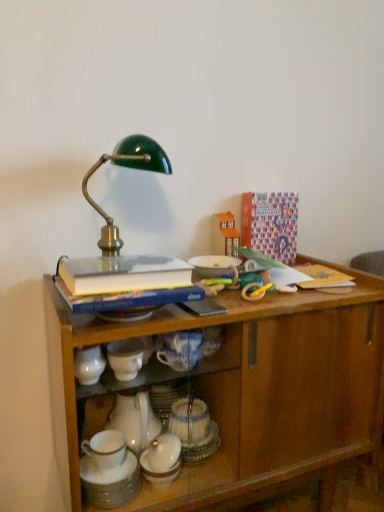
Question: Is wooden toy house at upper center, the 1th toy viewed from the back, at the left side of wooden cabinet at center?

Choices:
 (A) yes
 (B) no

Answer: (B)

Question: Considering the relative sizes of wooden toy house at upper center, marked as the second toy in a front-to-back arrangement, and wooden cabinet at center in the image provided, is wooden toy house at upper center, marked as the second toy in a front-to-back arrangement, taller than wooden cabinet at center?

Choices:
 (A) yes
 (B) no

Answer: (B)

Question: Is wooden toy house at upper center, which appears as the second toy when ordered from the bottom, outside of wooden cabinet at center?

Choices:
 (A) no
 (B) yes

Answer: (B)

Question: From the image's perspective, is wooden toy house at upper center, the 1th toy viewed from the back, located beneath wooden cabinet at center?

Choices:
 (A) no
 (B) yes

Answer: (A)

Question: Does wooden toy house at upper center, which appears as the second toy when ordered from the bottom, have a lesser height compared to wooden cabinet at center?

Choices:
 (A) no
 (B) yes

Answer: (B)

Question: Considering the positions of wooden cabinet at center and wooden toy house at upper center, marked as the second toy in a front-to-back arrangement, in the image, is wooden cabinet at center bigger or smaller than wooden toy house at upper center, marked as the second toy in a front-to-back arrangement,?

Choices:
 (A) big
 (B) small

Answer: (A)

Question: From the image's perspective, is wooden cabinet at center located above or below wooden toy house at upper center, the 1th toy viewed from the back?

Choices:
 (A) above
 (B) below

Answer: (B)

Question: Is wooden cabinet at center in front of or behind wooden toy house at upper center, the 1th toy viewed from the back, in the image?

Choices:
 (A) behind
 (B) front

Answer: (B)

Question: From their relative heights in the image, would you say wooden cabinet at center is taller or shorter than wooden toy house at upper center, which appears as the second toy when ordered from the bottom?

Choices:
 (A) tall
 (B) short

Answer: (A)

Question: From their relative heights in the image, would you say hardcover book at upper center is taller or shorter than wooden toy house at upper center, marked as the second toy in a front-to-back arrangement?

Choices:
 (A) short
 (B) tall

Answer: (A)

Question: Is hardcover book at upper center spatially inside wooden toy house at upper center, arranged as the 1th toy when viewed from the top, or outside of it?

Choices:
 (A) inside
 (B) outside

Answer: (B)

Question: Considering the relative positions of hardcover book at upper center and wooden toy house at upper center, marked as the second toy in a front-to-back arrangement, in the image provided, is hardcover book at upper center to the left or to the right of wooden toy house at upper center, marked as the second toy in a front-to-back arrangement,?

Choices:
 (A) left
 (B) right

Answer: (A)

Question: From a real-world perspective, is hardcover book at upper center above or below wooden toy house at upper center, which appears as the second toy when ordered from the bottom?

Choices:
 (A) above
 (B) below

Answer: (B)

Question: In terms of width, does rubber yellow and blue teething ring at upper right, the second toy from the back, look wider or thinner when compared to white glossy cup at lower center?

Choices:
 (A) wide
 (B) thin

Answer: (B)

Question: Considering their positions, is rubber yellow and blue teething ring at upper right, which appears as the first toy when viewed from the front, located in front of or behind white glossy cup at lower center?

Choices:
 (A) front
 (B) behind

Answer: (B)